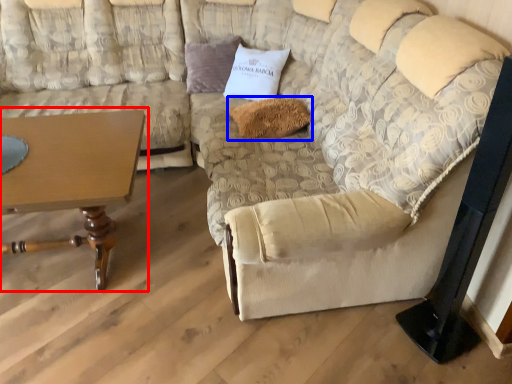
Question: Which object is closer to the camera taking this photo, table (highlighted by a red box) or pillow (highlighted by a blue box)?

Choices:
 (A) table
 (B) pillow

Answer: (A)